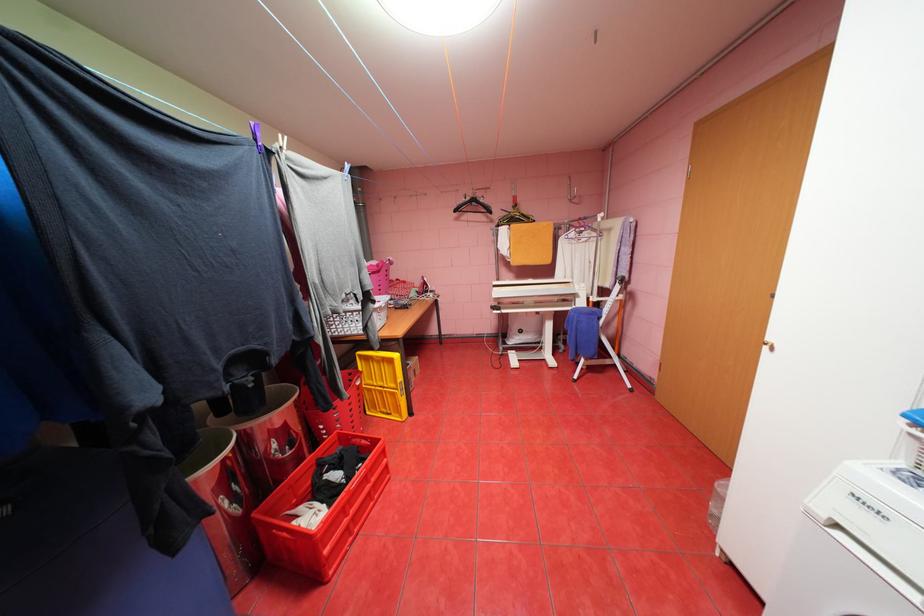
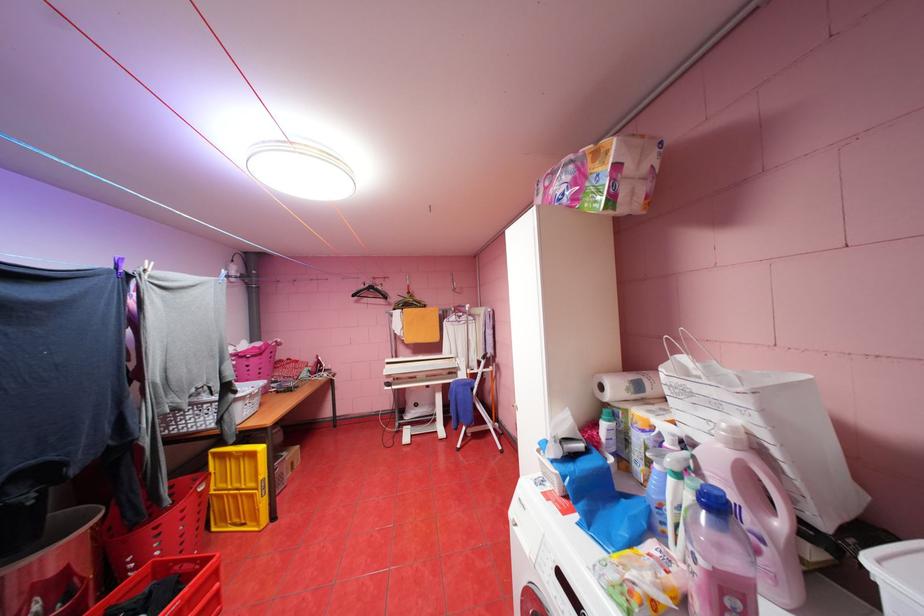
Where in the second image is the point corresponding to (x=370, y=355) from the first image?

(224, 454)